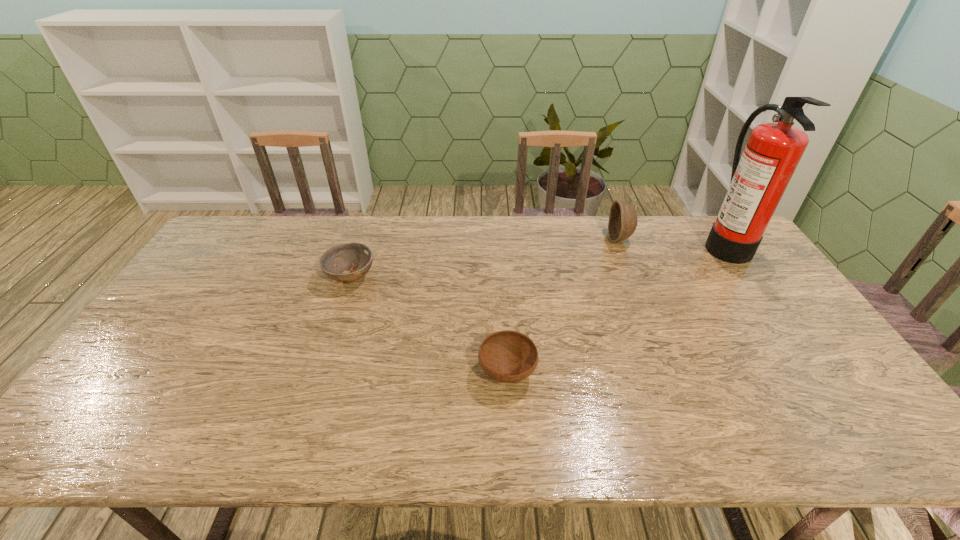
In the image, there is a desktop. Identify the location of vacant space at the left edge. (189, 306).

You are a GUI agent. You are given a task and a screenshot of the screen. Output one action in this format:
    pyautogui.click(x=<x>, y=<y>)
    Task: Click on the free space at the right edge of the desktop
    The image size is (960, 540).
    Given the screenshot: What is the action you would take?
    pyautogui.click(x=858, y=408)

Locate an element on the screen. The width and height of the screenshot is (960, 540). free space between the farthest bowl and the tallest object is located at coordinates (672, 241).

Identify the location of blank region between the nearest object and the rightmost object. (615, 308).

Locate an element on the screen. This screenshot has height=540, width=960. free spot between the rightmost object and the leftmost bowl is located at coordinates pyautogui.click(x=538, y=260).

Locate an element on the screen. Image resolution: width=960 pixels, height=540 pixels. free spot between the nearest object and the rightmost bowl is located at coordinates (564, 306).

Image resolution: width=960 pixels, height=540 pixels. Find the location of `empty space that is in between the third shortest object and the second bowl from left to right`. empty space that is in between the third shortest object and the second bowl from left to right is located at coordinates (x=564, y=306).

The width and height of the screenshot is (960, 540). Identify the location of unoccupied area between the third object from right to left and the fire extinguisher. (615, 308).

Image resolution: width=960 pixels, height=540 pixels. In order to click on free space between the tallest bowl and the tallest object in this screenshot , I will do `click(672, 241)`.

Identify the location of empty space that is in between the fire extinguisher and the rightmost bowl. (672, 241).